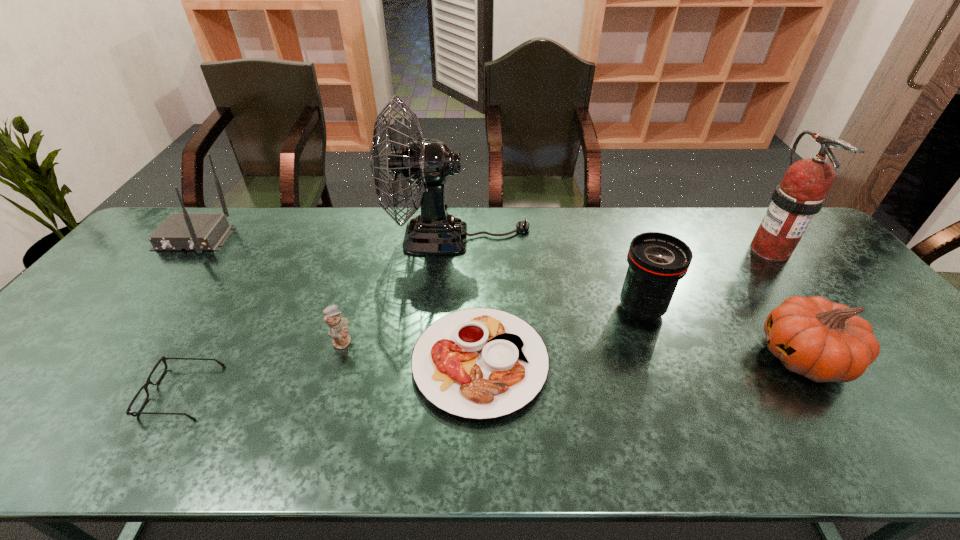
Locate an element on the screen. The height and width of the screenshot is (540, 960). fan is located at coordinates (426, 163).

Locate an element on the screen. This screenshot has width=960, height=540. the seventh shortest object is located at coordinates (801, 194).

This screenshot has width=960, height=540. Find the location of `router`. router is located at coordinates (198, 232).

Where is `the sixth shortest object`? This screenshot has height=540, width=960. the sixth shortest object is located at coordinates (198, 232).

Where is `telephoto lens`? The image size is (960, 540). telephoto lens is located at coordinates (657, 261).

Where is `the fifth tallest object`? the fifth tallest object is located at coordinates (824, 341).

The width and height of the screenshot is (960, 540). Find the location of `the third shortest object`. the third shortest object is located at coordinates (338, 327).

Where is `teddy bear`? teddy bear is located at coordinates (338, 327).

Where is `platter`? The height and width of the screenshot is (540, 960). platter is located at coordinates (478, 363).

This screenshot has height=540, width=960. In order to click on the seventh object from right to left in this screenshot , I will do `click(145, 386)`.